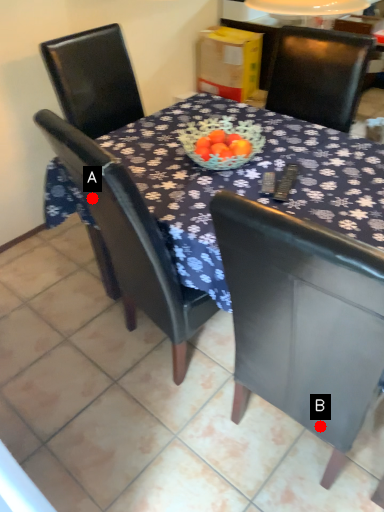
Question: Two points are circled on the image, labeled by A and B beside each circle. Among these points, which one is farthest from the camera?

Choices:
 (A) A is further
 (B) B is further

Answer: (A)